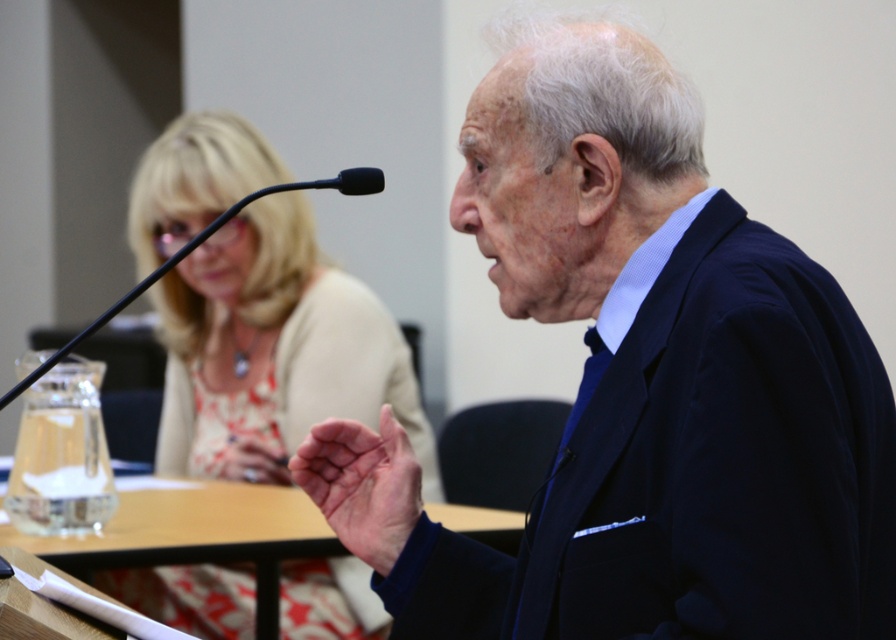
Which is behind, point (828, 497) or point (251, 525)?

The point (251, 525) is more distant.

Is blue fabric suit at center thinner than clear glass table at center?

Yes, blue fabric suit at center is thinner than clear glass table at center.

Who is more distant from viewer, [459,538] or [261,532]?

Point [261,532]

Locate an element on the screen. The height and width of the screenshot is (640, 896). blue fabric suit at center is located at coordinates (642, 387).

Does blue fabric suit at center have a greater height compared to matte beige blouse at upper left?

Incorrect, blue fabric suit at center's height is not larger of matte beige blouse at upper left's.

Is blue fabric suit at center positioned behind matte beige blouse at upper left?

No, blue fabric suit at center is closer to the viewer.

Between point (490, 80) and point (243, 476), which one is positioned behind?

Point (243, 476)

What are the coordinates of `blue fabric suit at center` in the screenshot? It's located at (642, 387).

Is blue fabric suit at center below pink skin at center?

Incorrect, blue fabric suit at center is not positioned below pink skin at center.

Locate an element on the screen. The width and height of the screenshot is (896, 640). blue fabric suit at center is located at coordinates (642, 387).